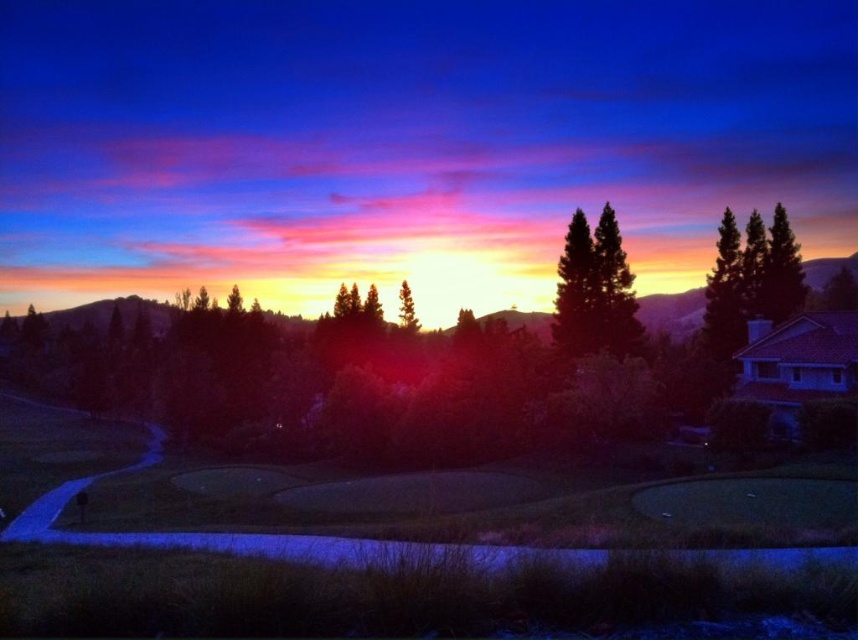
Question: Does green grassy golf course at lower center appear under silvery metallic tree at center?

Choices:
 (A) no
 (B) yes

Answer: (B)

Question: Which object appears closest to the camera in this image?

Choices:
 (A) green matte tree at upper right
 (B) green grassy golf course at lower center

Answer: (B)

Question: Does green matte tree at upper right appear on the left side of silvery metallic tree at center?

Choices:
 (A) yes
 (B) no

Answer: (B)

Question: Considering the real-world distances, which object is closest to the green matte tree at center?

Choices:
 (A) green matte tree at upper right
 (B) silvery metallic tree at center
 (C) green grassy golf course at lower center

Answer: (A)

Question: Which point is closer to the camera?

Choices:
 (A) (x=448, y=616)
 (B) (x=587, y=228)
 (C) (x=772, y=225)
 (D) (x=403, y=308)

Answer: (A)

Question: Is green matte tree at upper right below silvery metallic tree at center?

Choices:
 (A) no
 (B) yes

Answer: (A)